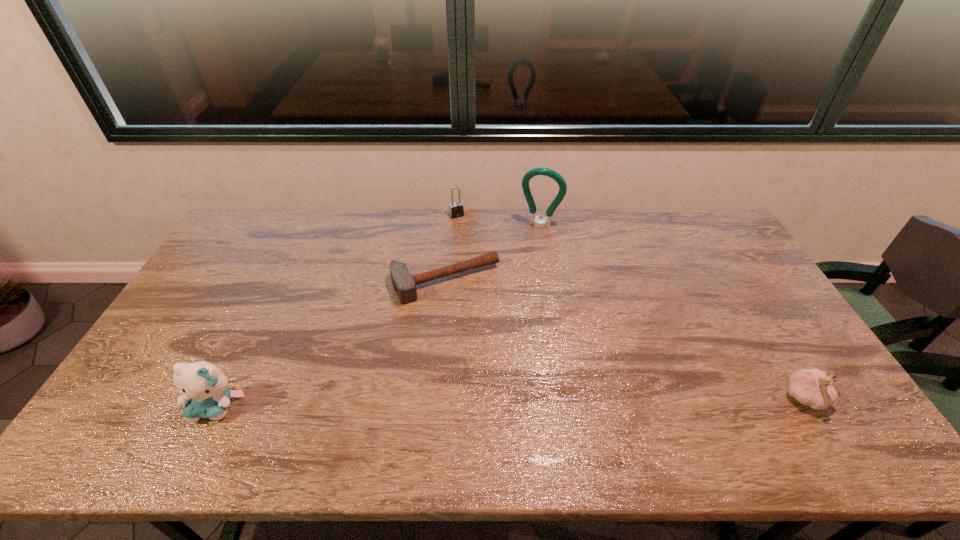
Identify the location of object that is the closest to the bottle opener. This screenshot has height=540, width=960. (404, 284).